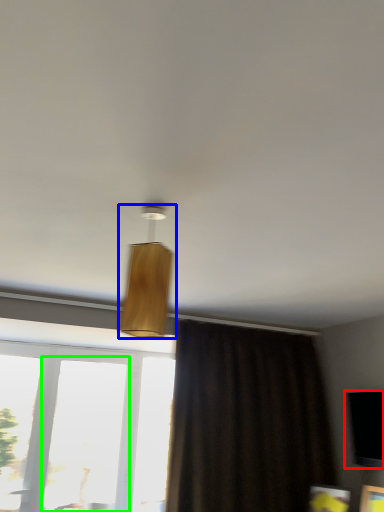
Question: Based on their relative distances, which object is farther from window screen (highlighted by a red box)? Choose from lamp (highlighted by a blue box) and window (highlighted by a green box).

Choices:
 (A) lamp
 (B) window

Answer: (B)